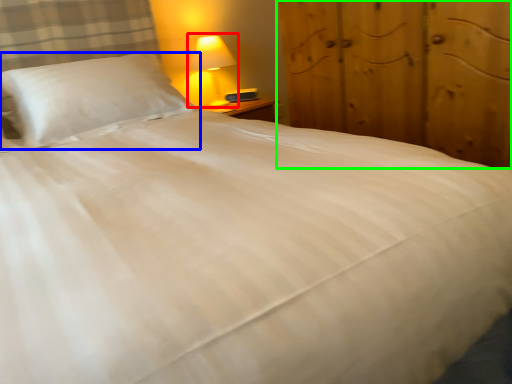
Question: Which is nearer to the lamp (highlighted by a red box)? pillow (highlighted by a blue box) or dresser (highlighted by a green box).

Choices:
 (A) pillow
 (B) dresser

Answer: (A)